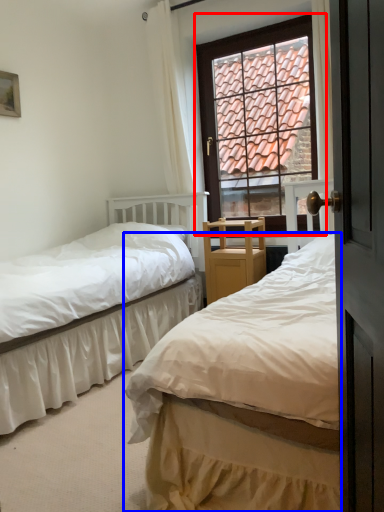
Question: Which object appears closest to the camera in this image, window (highlighted by a red box) or bed (highlighted by a blue box)?

Choices:
 (A) window
 (B) bed

Answer: (B)